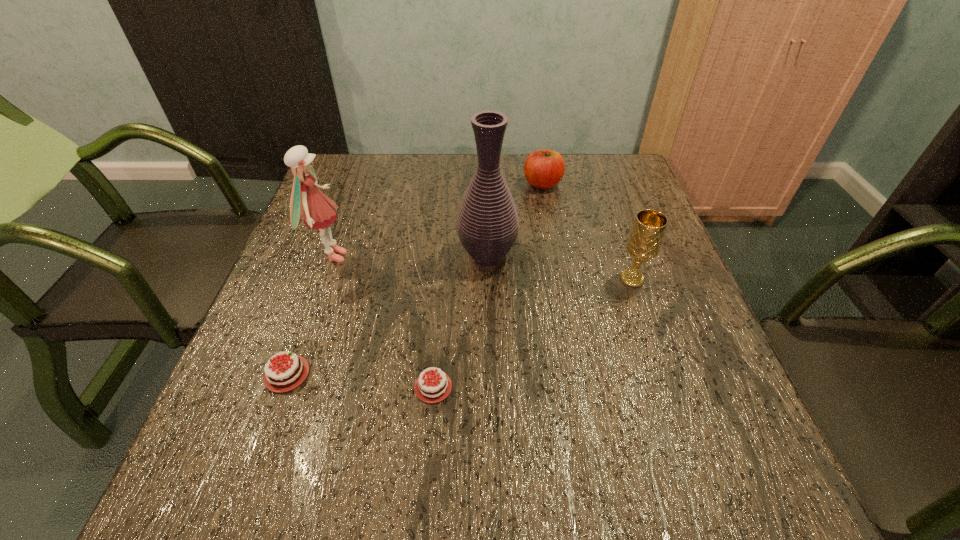
Please point a spot to add another chocolate cake on the right. Please provide its 2D coordinates. Your answer should be formatted as a tuple, i.e. [(x, y)], where the tuple contains the x and y coordinates of a point satisfying the conditions above.

[(587, 401)]